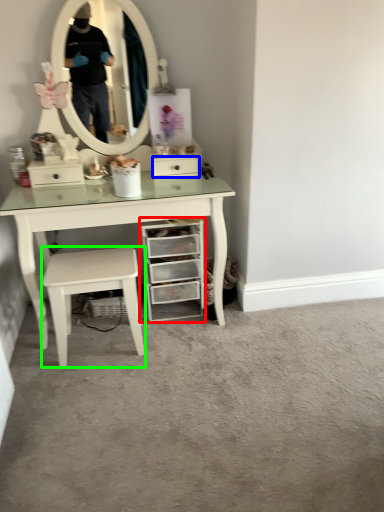
Question: Which object is the farthest from chest of drawers (highlighted by a red box)? Choose among these: drawer (highlighted by a blue box) or stool (highlighted by a green box).

Choices:
 (A) drawer
 (B) stool

Answer: (A)